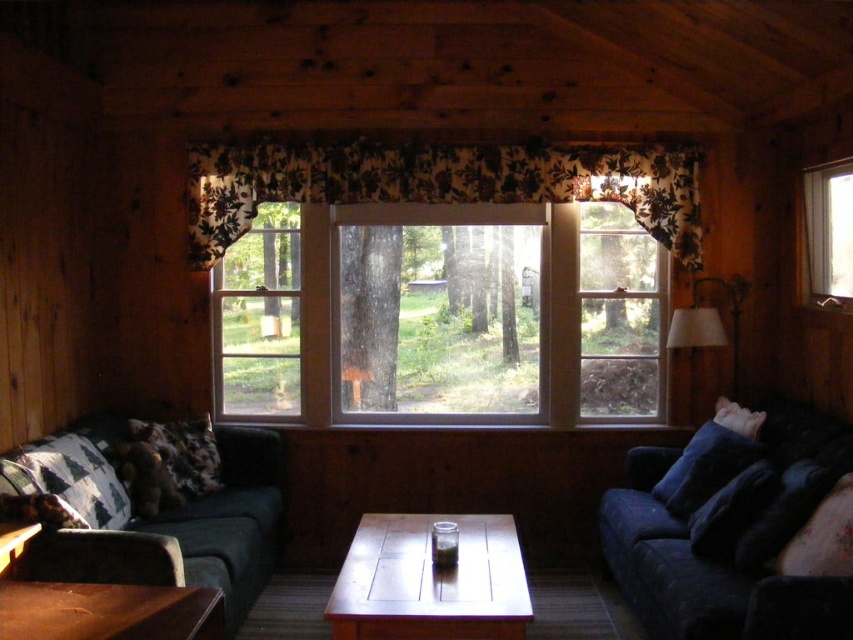
Question: Which point appears closest to the camera in this image?

Choices:
 (A) (173, 474)
 (B) (825, 522)
 (C) (740, 492)
 (D) (677, 163)

Answer: (B)

Question: Does floral fabric valance at center have a lesser width compared to green fabric couch at left?

Choices:
 (A) no
 (B) yes

Answer: (A)

Question: Which point is closer to the camera?

Choices:
 (A) tap(183, 486)
 (B) tap(189, 515)

Answer: (B)

Question: Is green fabric couch at left bigger than fluffy brown pillow at lower left?

Choices:
 (A) yes
 (B) no

Answer: (A)

Question: Is clear glass window at center further to the viewer compared to wooden table at center?

Choices:
 (A) no
 (B) yes

Answer: (B)

Question: Which point is closer to the camera?

Choices:
 (A) velvety dark blue pillow at lower right
 (B) wooden coffee table at lower center

Answer: (B)